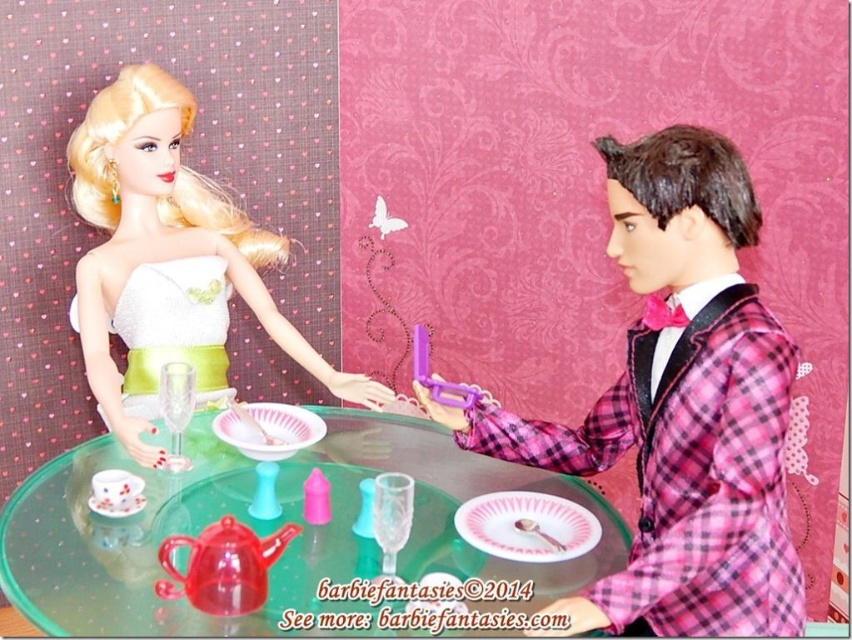
Measure the distance between matte white dress at upper left and white satin dress at upper left.

matte white dress at upper left is 33.43 inches away from white satin dress at upper left.

Does matte white dress at upper left appear on the right side of white satin dress at upper left?

Indeed, matte white dress at upper left is positioned on the right side of white satin dress at upper left.

This screenshot has height=640, width=852. Identify the location of matte white dress at upper left. (680, 406).

Is transparent glass table at center below white satin dress at upper left?

Yes.

Is point (186, 612) closer to camera compared to point (125, 195)?

Yes.

In order to click on transparent glass table at center in this screenshot , I will do `click(266, 528)`.

Does matte white dress at upper left have a greater height compared to transparent glass table at center?

Correct, matte white dress at upper left is much taller as transparent glass table at center.

Based on the photo, is matte white dress at upper left thinner than transparent glass table at center?

Correct, matte white dress at upper left's width is less than transparent glass table at center's.

The image size is (852, 640). Describe the element at coordinates (680, 406) in the screenshot. I see `matte white dress at upper left` at that location.

The height and width of the screenshot is (640, 852). What are the coordinates of `matte white dress at upper left` in the screenshot? It's located at 680,406.